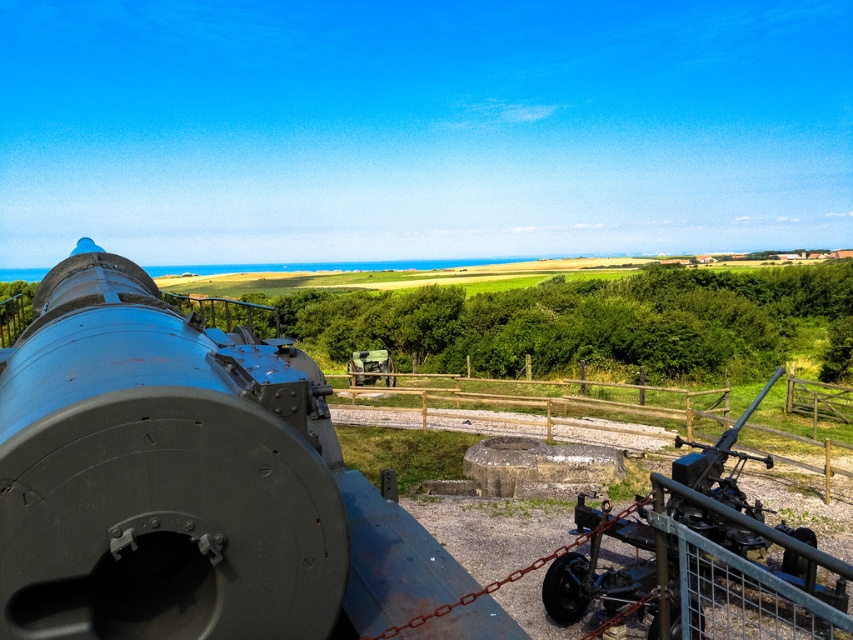
You are a photographer planning to take a photo of both the matte black cannon at left and the matte black cannon at right. Since you want both cannons to appear proportionally similar in size in your photo, which cannon should you move closer to, and which should you stay farther from?

To make both cannons appear proportionally similar in size in your photo, you should move closer to the matte black cannon at right and stay farther from the matte black cannon at left. This is because the matte black cannon at left is bigger in real life, so positioning yourself farther from it will reduce its apparent size in the photo, while moving closer to the smaller matte black cannon at right will increase its apparent size, balancing their sizes in the final image.

You are standing at the camera position and want to walk to both points. Which point should you reach first, point (x=103, y=547) or point (x=619, y=577)?

You should reach point (x=103, y=547) first because it is closer to the camera than point (x=619, y=577).